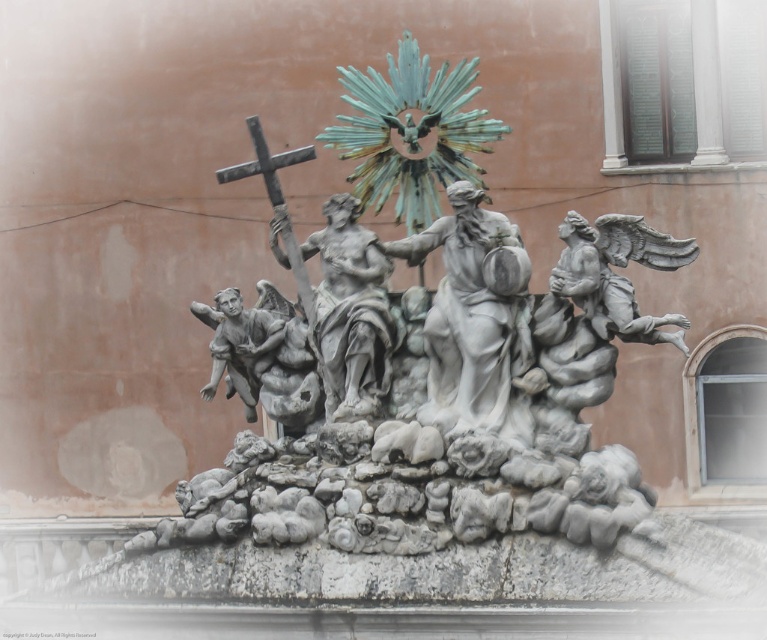
You are an art conservator assessing the placement of the polished bronze statue at center and the metallic cross at upper left. Based on their positions, which object is located below the other?

The polished bronze statue at center is positioned under metallic cross at upper left, so the statue is below the cross.

You are an art conservator assessing the structural stability of the polished bronze statue at center and the metallic cross at upper left. Which object has a narrower width?

The polished bronze statue at center is thinner than the metallic cross at upper left, so the polished bronze statue at center has a narrower width.